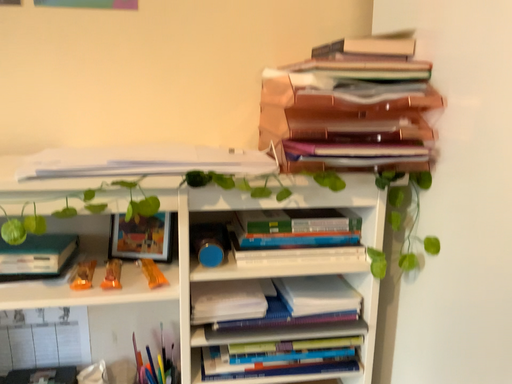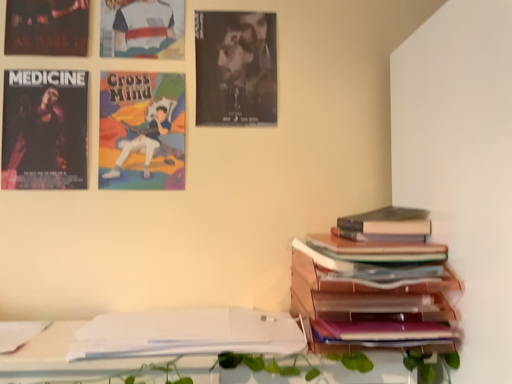
Question: How did the camera likely rotate when shooting the video?

Choices:
 (A) rotated upward
 (B) rotated downward

Answer: (A)